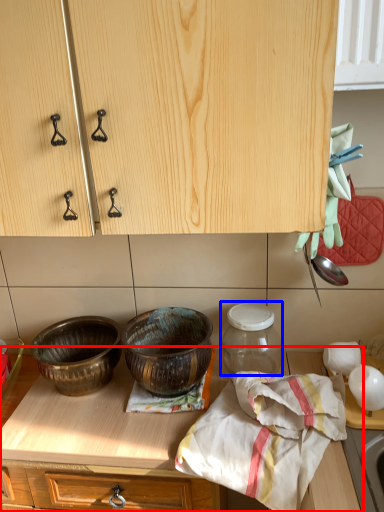
Question: Which of the following is the farthest to the observer, countertop (highlighted by a red box) or glass jar (highlighted by a blue box)?

Choices:
 (A) countertop
 (B) glass jar

Answer: (B)